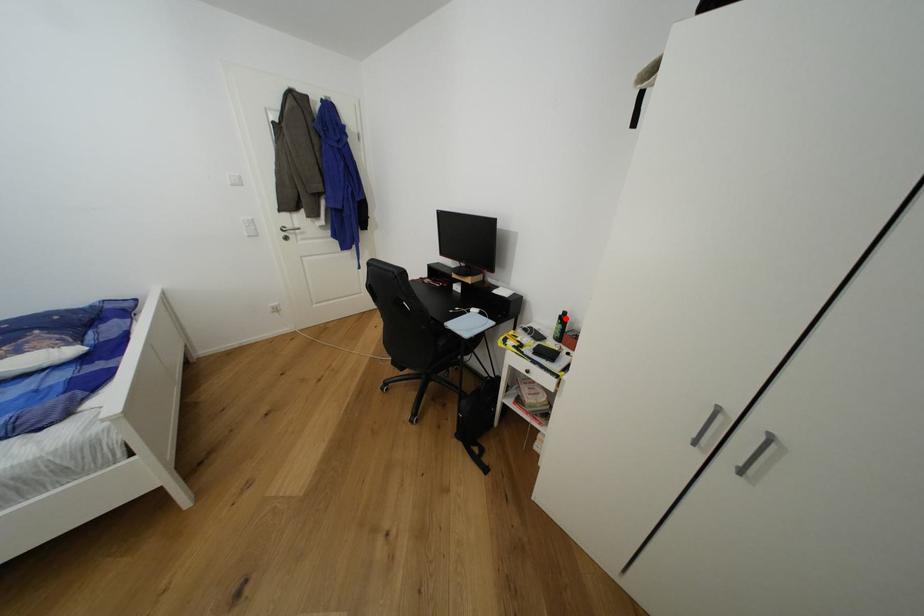
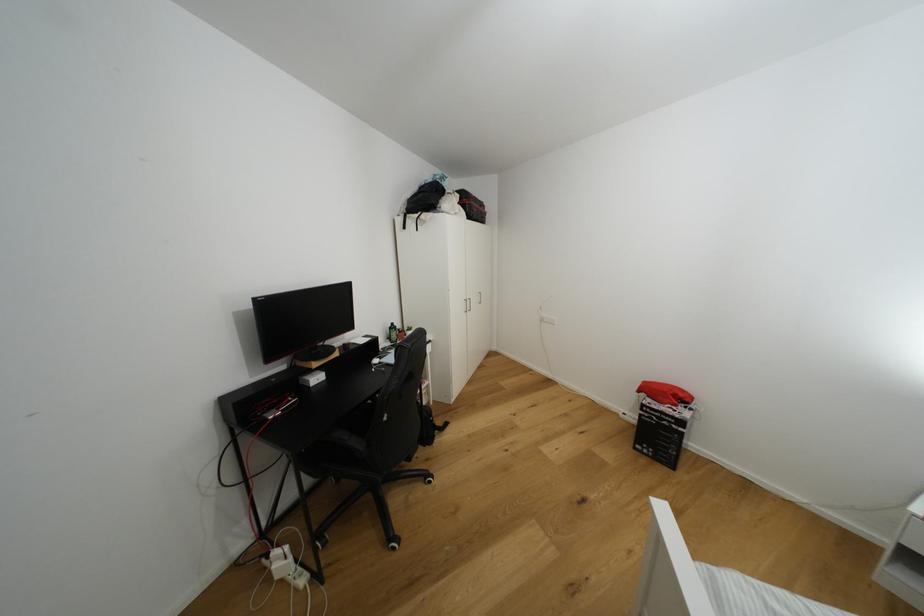
Where in the second image is the point corresponding to the highlighted location from the first image?

(395, 330)